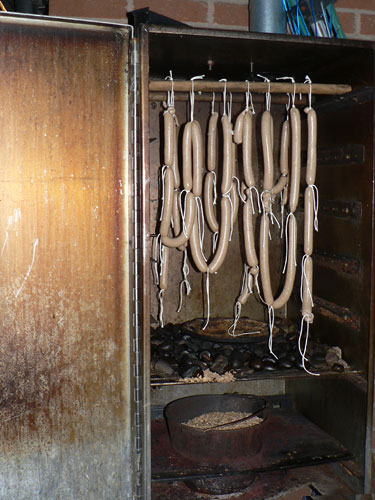
I want to click on brick wall, so click(x=224, y=13).